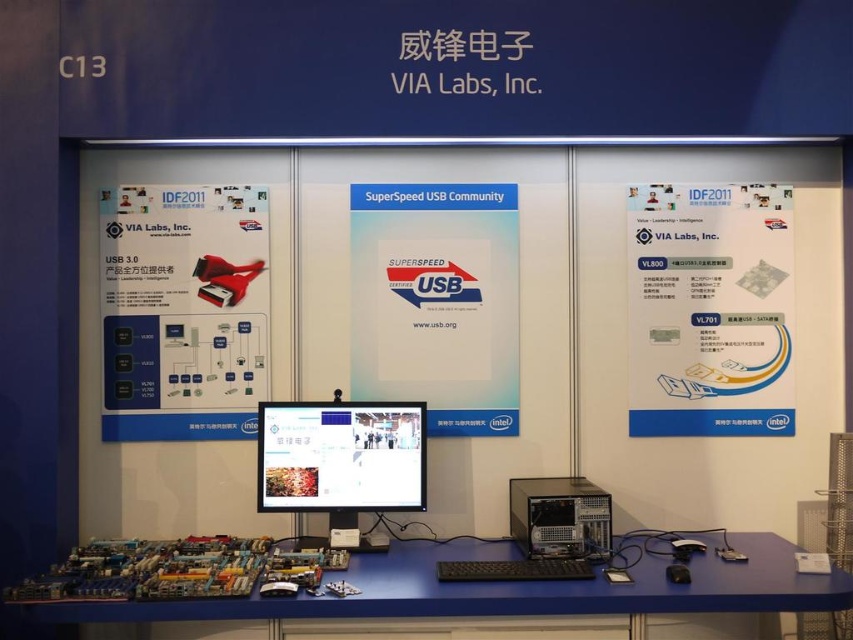
Question: Is blue plastic computer desk at lower left smaller than matte black monitor at center?

Choices:
 (A) yes
 (B) no

Answer: (B)

Question: Which point appears farthest from the camera in this image?

Choices:
 (A) click(596, 600)
 (B) click(280, 467)

Answer: (B)

Question: Which is nearer to the matte black monitor at center?

Choices:
 (A) black plastic computer at center
 (B) blue plastic computer desk at lower left

Answer: (B)

Question: Does blue plastic computer desk at lower left appear on the left side of matte black monitor at center?

Choices:
 (A) yes
 (B) no

Answer: (B)

Question: Is blue plastic computer desk at lower left wider than matte black monitor at center?

Choices:
 (A) no
 (B) yes

Answer: (B)

Question: Which object is closer to the camera taking this photo?

Choices:
 (A) blue plastic computer desk at lower left
 (B) black plastic computer at center
 (C) matte black monitor at center

Answer: (A)